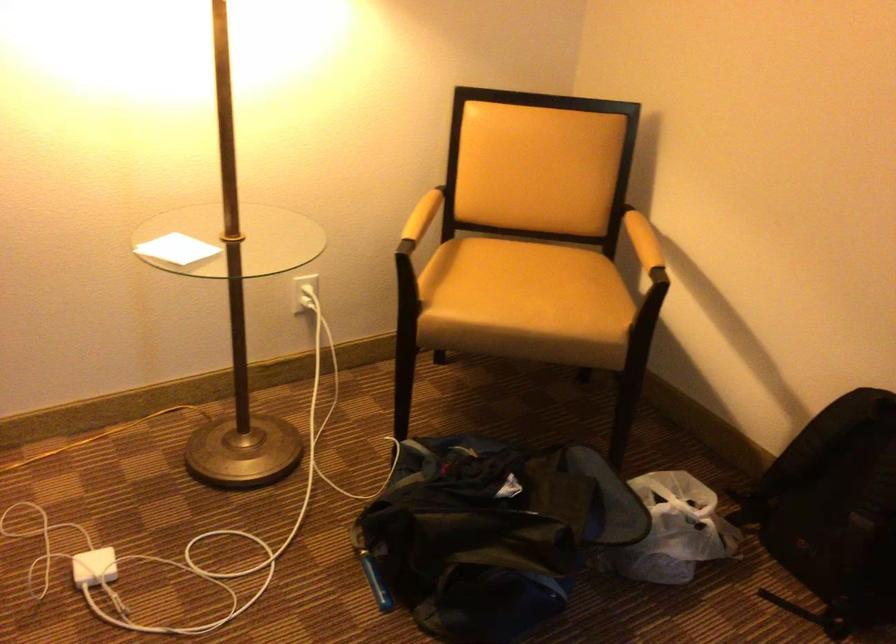
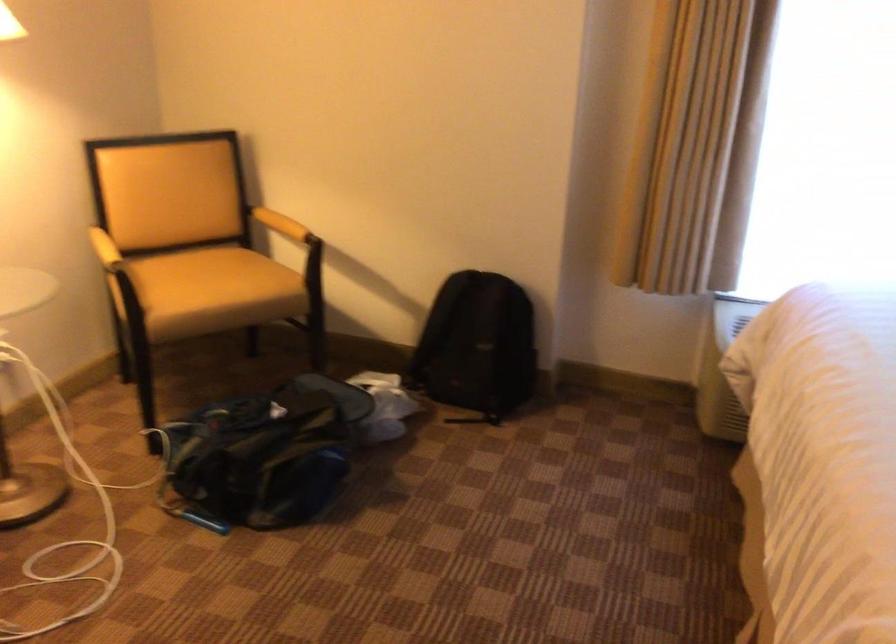
Question: How did the camera likely rotate?

Choices:
 (A) Left
 (B) Right
 (C) Up
 (D) Down

Answer: (B)